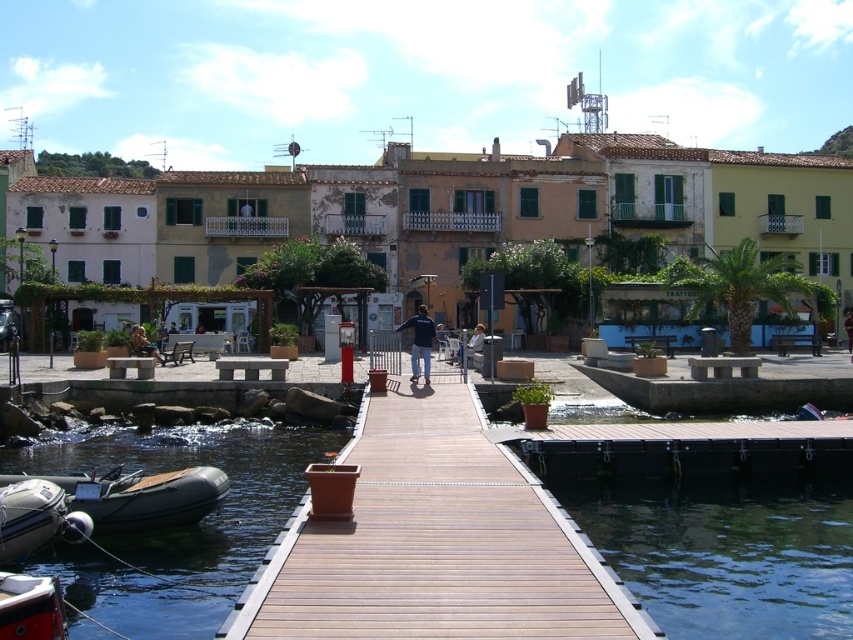
You are standing at the edge of the waterfront scene described. You see a point marked at coordinates [434,541]. Based on the scene description, what object is located at this point?

The point at coordinates [434,541] corresponds to the brown wooden dock at center.